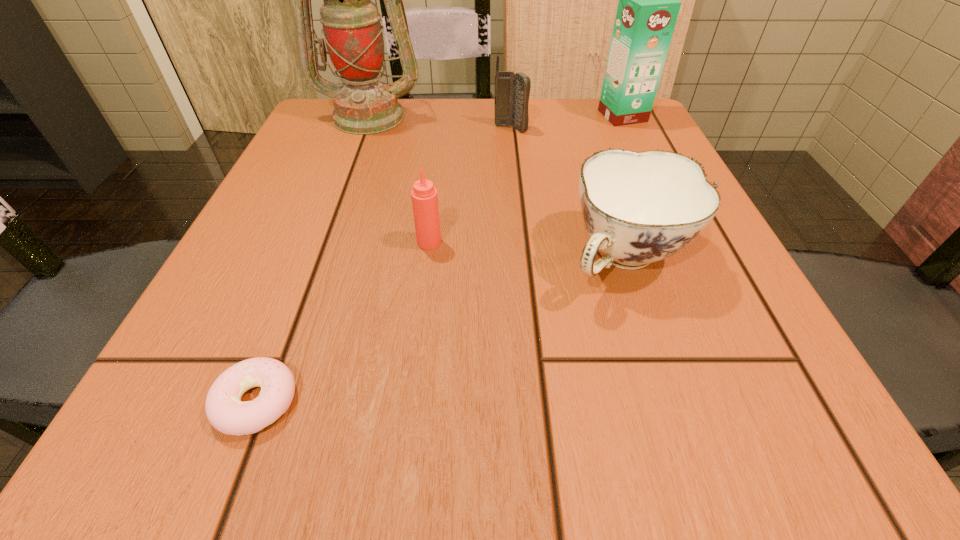
The height and width of the screenshot is (540, 960). Identify the location of oil lamp. (353, 34).

Find the location of a particular element. Image resolution: width=960 pixels, height=540 pixels. carton is located at coordinates (648, 7).

Identify the location of cellular telephone. This screenshot has width=960, height=540. (512, 91).

Image resolution: width=960 pixels, height=540 pixels. Identify the location of Tabasco sauce. (424, 196).

Find the location of a particular element. This screenshot has width=960, height=540. chinaware is located at coordinates 639,207.

You are a GUI agent. You are given a task and a screenshot of the screen. Output one action in this format:
    pyautogui.click(x=<x>, y=<y>)
    Task: Click on the shortest object
    The image size is (960, 540).
    Given the screenshot: What is the action you would take?
    pyautogui.click(x=225, y=411)

The image size is (960, 540). I want to click on the nearest object, so click(x=225, y=411).

The height and width of the screenshot is (540, 960). Identify the location of vacant area situated 0.290m on the front of the oil lamp. (329, 224).

Where is `blank space located on the front of the fifth shortest object`? The height and width of the screenshot is (540, 960). blank space located on the front of the fifth shortest object is located at coordinates (685, 247).

This screenshot has height=540, width=960. What are the coordinates of `vacant space located on the keyboard of the third object from right to left` in the screenshot? It's located at [x=518, y=208].